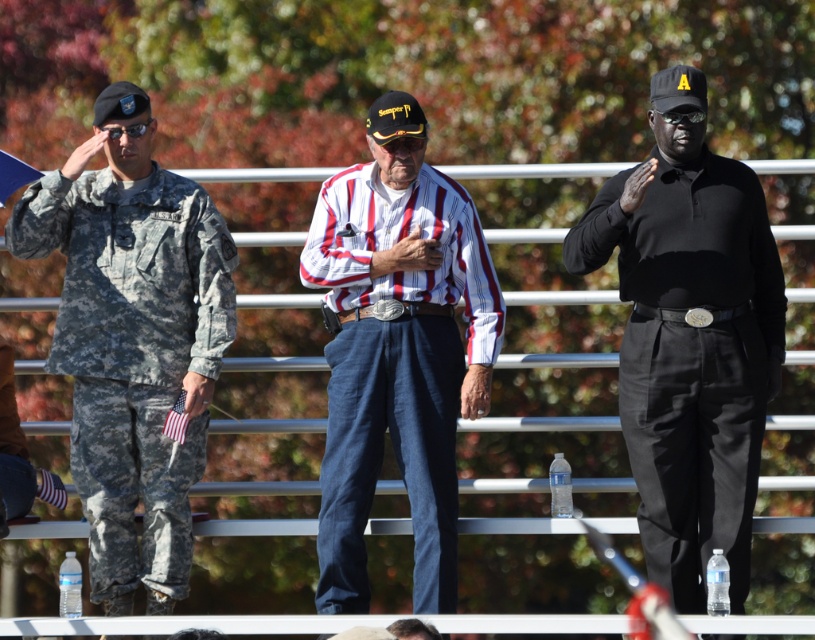
You are organizing a photo shoot and need to place two objects in the scene. The striped cotton shirt at center and the camouflage fabric uniform at left must be arranged so that the larger one is placed behind the smaller one for depth. Which object should be placed behind the other?

The striped cotton shirt at center is larger in size than the camouflage fabric uniform at left, so the striped cotton shirt at center should be placed behind the camouflage fabric uniform at left to create depth.